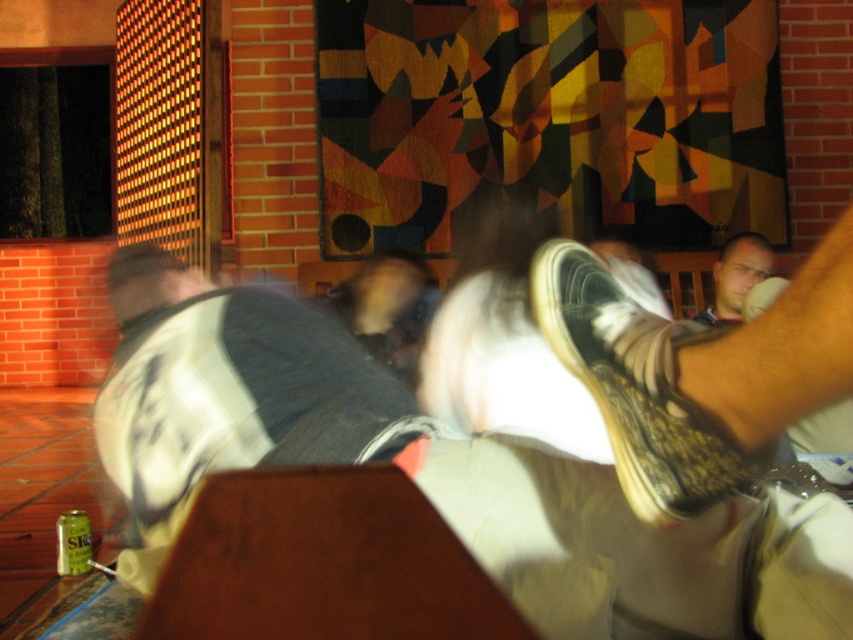
Question: In this image, where is white cotton shirt at upper center located relative to smooth skin face at upper right?

Choices:
 (A) below
 (B) above

Answer: (A)

Question: Is the position of white cotton shirt at upper center more distant than that of worn leather shoe at lower right?

Choices:
 (A) yes
 (B) no

Answer: (B)

Question: Which object is farther from the camera taking this photo?

Choices:
 (A) white cotton shirt at upper center
 (B) smooth skin face at upper right
 (C) worn leather shoe at lower right

Answer: (B)

Question: Does white cotton shirt at upper center have a smaller size compared to worn leather shoe at lower right?

Choices:
 (A) no
 (B) yes

Answer: (A)

Question: Which of the following is the farthest from the observer?

Choices:
 (A) white cotton shirt at upper center
 (B) smooth skin face at upper right
 (C) worn leather shoe at lower right

Answer: (B)

Question: Among these points, which one is farthest from the camera?

Choices:
 (A) (383, 426)
 (B) (692, 317)

Answer: (B)